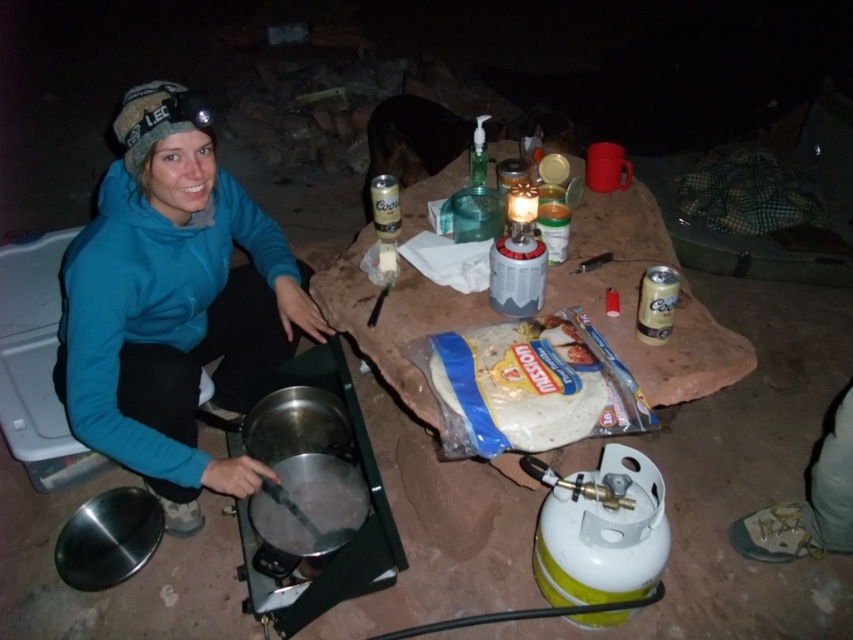
You are standing in the nighttime outdoor cooking scene. You see a point marked at coordinates [172,304]. What object is located at that point?

The point at coordinates [172,304] marks the blue fleece jacket at center.

You are a hiker who needs to pack your backpack. You have a blue fleece jacket at center and white plastic tortillas at center. Which item takes up more vertical space in your backpack?

The blue fleece jacket at center is much taller than the white plastic tortillas at center, so it will take up more vertical space in the backpack.

You are a hiker who needs to reach the white plastic tortillas at center from the blue fleece jacket at center. Can you comfortably reach them without moving your torso?

The distance between the blue fleece jacket at center and the white plastic tortillas at center is 25.93 inches, which is approximately 2.16 feet. Since the average human arm length is about 2.5 feet, you can comfortably reach the white plastic tortillas at center without moving your torso.